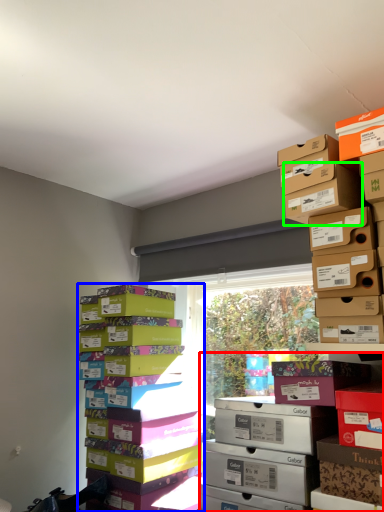
Question: Considering the real-world distances, which object is closest to shelf (highlighted by a red box)? package (highlighted by a blue box) or cardboard box (highlighted by a green box).

Choices:
 (A) package
 (B) cardboard box

Answer: (A)